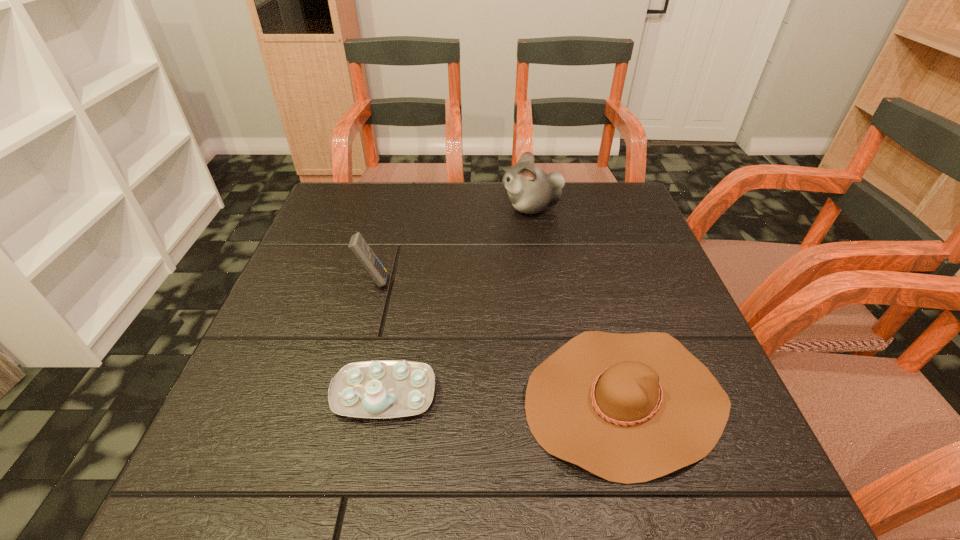
Find the location of a particular element. This screenshot has width=960, height=540. hamster is located at coordinates (531, 190).

Identify the location of the tallest object. The height and width of the screenshot is (540, 960). (531, 190).

Where is `the second tallest object`? the second tallest object is located at coordinates (359, 247).

At what (x,y) coordinates should I click in order to perform the action: click on calculator. Please return your answer as a coordinate pair (x, y). Image resolution: width=960 pixels, height=540 pixels. Looking at the image, I should click on (359, 247).

This screenshot has width=960, height=540. I want to click on chinaware, so click(x=384, y=388).

The width and height of the screenshot is (960, 540). Identify the location of cowboy hat. (629, 408).

The width and height of the screenshot is (960, 540). Identify the location of vacant space located on the face of the tallest object. (435, 207).

Image resolution: width=960 pixels, height=540 pixels. I want to click on vacant space situated 0.280m on the face of the tallest object, so click(x=398, y=207).

Locate an element on the screen. The image size is (960, 540). vacant space located 0.050m on the face of the tallest object is located at coordinates (483, 207).

In order to click on free location located on the front-facing side of the third nearest object in this screenshot , I will do (x=550, y=281).